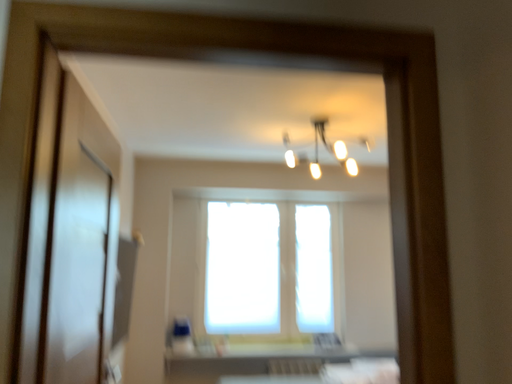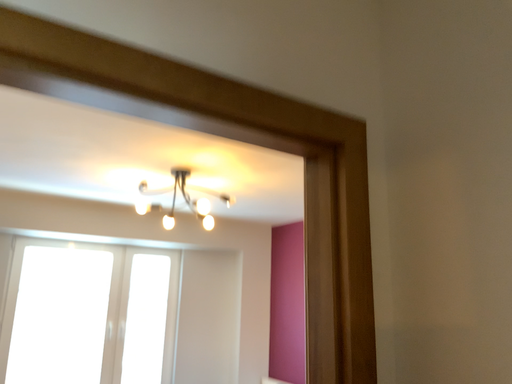
Question: Which way did the camera rotate in the video?

Choices:
 (A) rotated left
 (B) rotated right

Answer: (B)